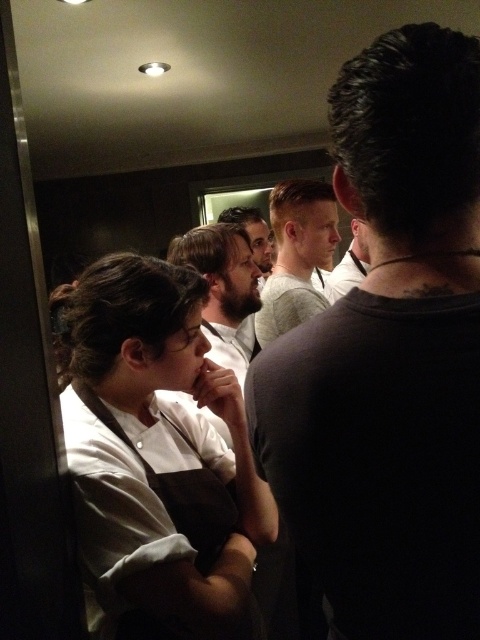
Question: Which of these objects is positioned closest to the bearded man at center?

Choices:
 (A) white matte chef coat at left
 (B) light brown hair at center

Answer: (B)

Question: Is white matte chef coat at left bigger than bearded man at center?

Choices:
 (A) yes
 (B) no

Answer: (B)

Question: Considering the real-world distances, which object is farthest from the white matte chef coat at left?

Choices:
 (A) dark gray shirt at right
 (B) light brown hair at center

Answer: (B)

Question: Is light brown hair at center positioned behind matte black shirt at center?

Choices:
 (A) no
 (B) yes

Answer: (A)

Question: In this image, where is light brown hair at center located relative to matte black shirt at center?

Choices:
 (A) left
 (B) right

Answer: (A)

Question: Which point is farther to the camera?

Choices:
 (A) (419, 328)
 (B) (264, 256)
 (C) (300, 216)
 (D) (137, 332)

Answer: (B)